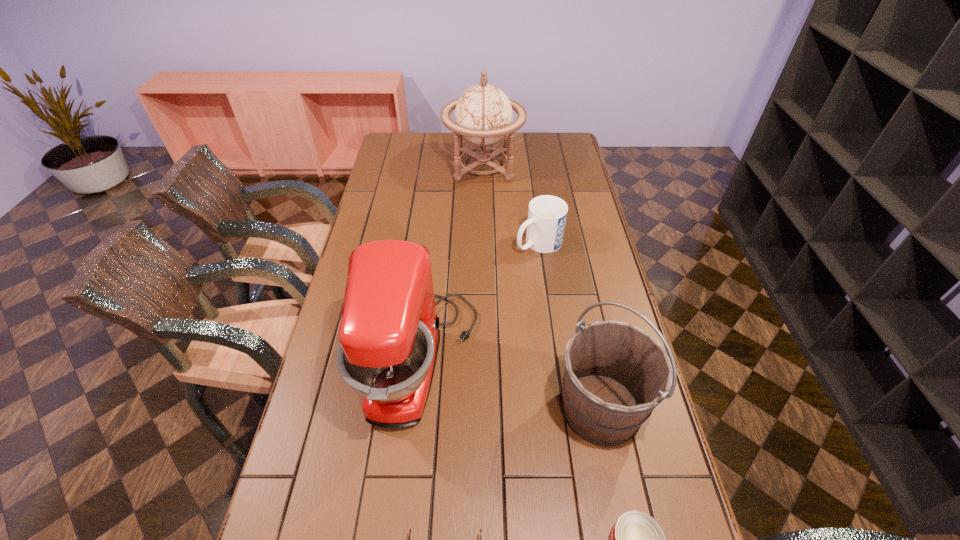
Locate an element on the screen. The width and height of the screenshot is (960, 540). object present at the far edge is located at coordinates (483, 114).

Where is `object at the left edge`? The width and height of the screenshot is (960, 540). object at the left edge is located at coordinates (389, 334).

This screenshot has width=960, height=540. In order to click on bucket that is at the right edge in this screenshot , I will do `click(615, 374)`.

At what (x,y) coordinates should I click in order to perform the action: click on mug that is at the right edge. Please return your answer as a coordinate pair (x, y). The image size is (960, 540). Looking at the image, I should click on (547, 214).

What are the coordinates of `vacant space at the far edge` in the screenshot? It's located at coord(420,152).

Locate an element on the screen. This screenshot has height=540, width=960. vacant area at the left edge is located at coordinates (401, 188).

In order to click on blank space at the right edge in this screenshot , I will do `click(611, 294)`.

This screenshot has height=540, width=960. I want to click on vacant area at the far left corner of the desktop, so click(384, 151).

Image resolution: width=960 pixels, height=540 pixels. Find the location of `vacant space at the far right corner of the desktop`. vacant space at the far right corner of the desktop is located at coordinates (543, 150).

This screenshot has height=540, width=960. I want to click on free space between the mug and the bucket, so click(569, 326).